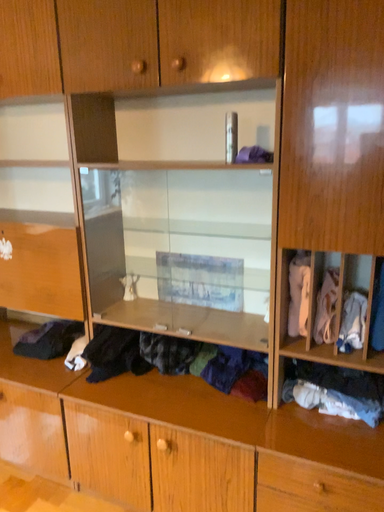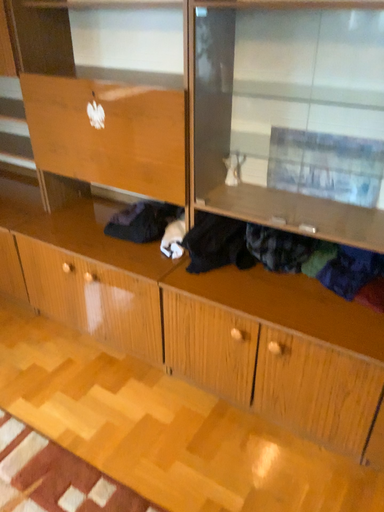
Question: How did the camera likely rotate when shooting the video?

Choices:
 (A) rotated upward
 (B) rotated downward

Answer: (B)